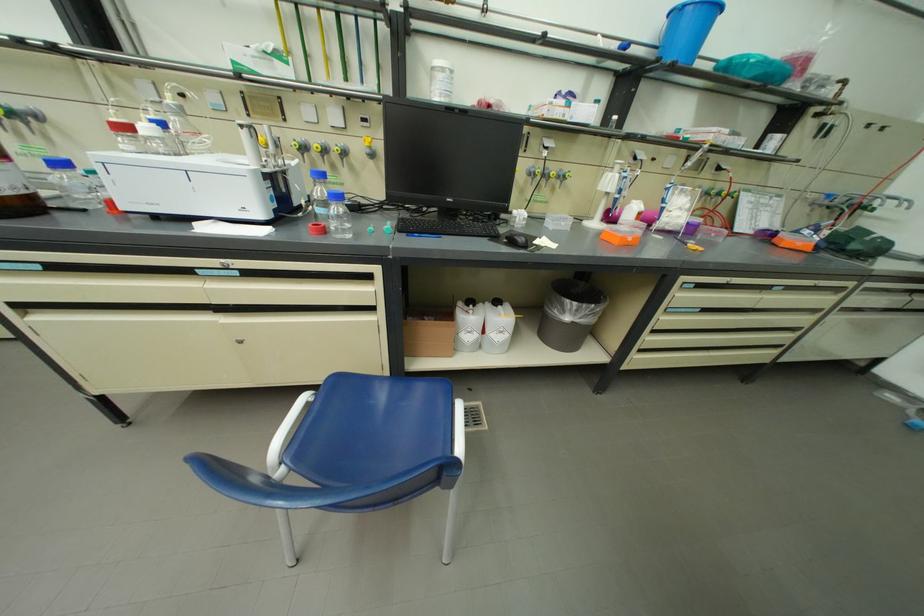
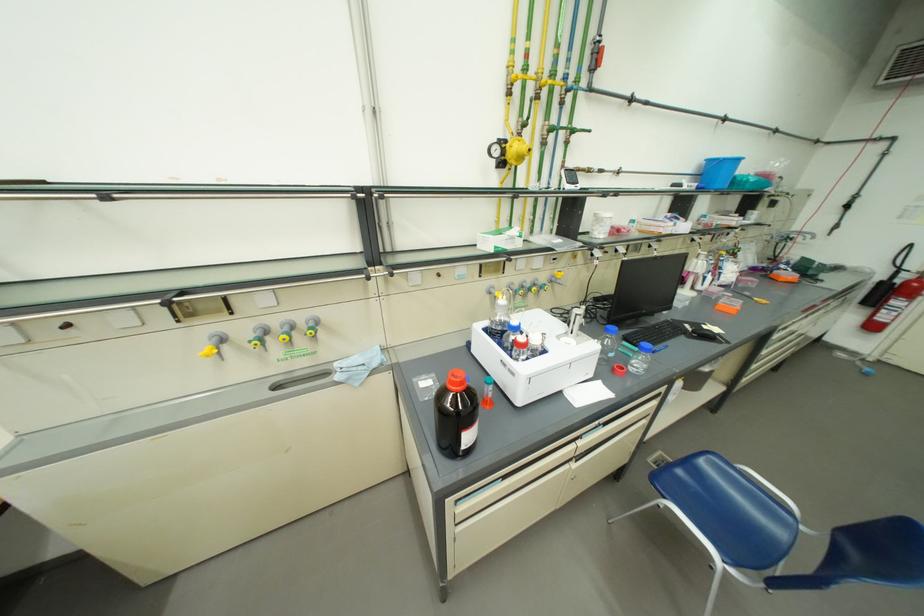
In the second image, find the point that corresponds to point 306,392 in the first image.

(673, 506)